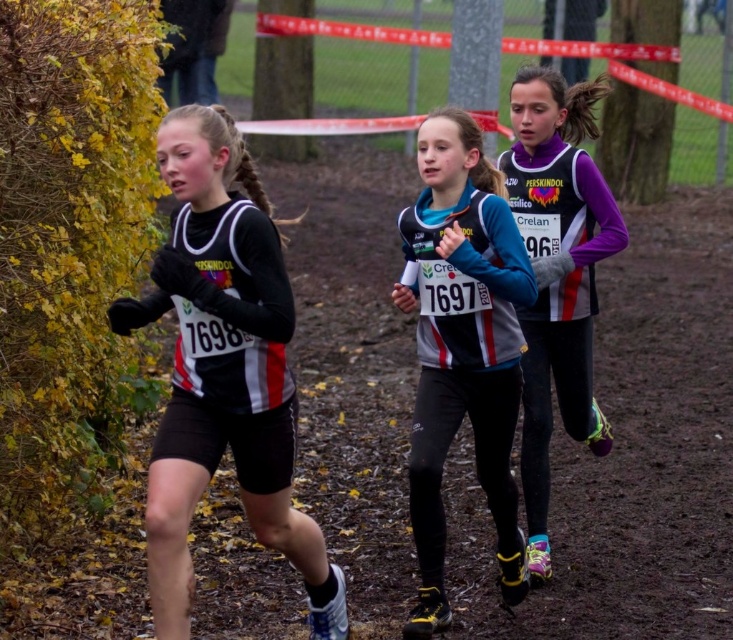
Who is more forward, (257, 602) or (445, 612)?

Point (445, 612)

The image size is (733, 640). In order to click on brown dirt track at center in this screenshot , I will do `click(630, 452)`.

Can you confirm if brown dirt track at center is positioned to the right of purple matte vest at center?

In fact, brown dirt track at center is to the left of purple matte vest at center.

Can you confirm if brown dirt track at center is taller than purple matte vest at center?

Correct, brown dirt track at center is much taller as purple matte vest at center.

Describe the element at coordinates (630, 452) in the screenshot. This screenshot has height=640, width=733. I see `brown dirt track at center` at that location.

Where is `brown dirt track at center`? brown dirt track at center is located at coordinates (630, 452).

Does brown dirt track at center lie behind matte black running suit at left?

Yes.

Between brown dirt track at center and matte black running suit at left, which one has more height?

brown dirt track at center

Does point (674, 424) come closer to viewer compared to point (235, 330)?

No, it is not.

In order to click on brown dirt track at center in this screenshot , I will do `click(630, 452)`.